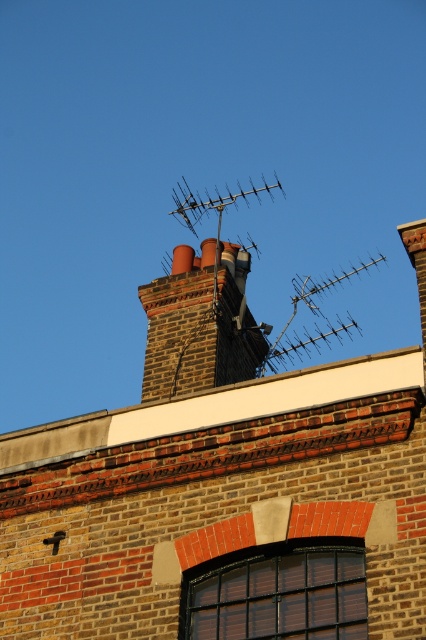
Question: Can you confirm if metallic antenna at upper center is positioned above metallic silver antenna at center?

Choices:
 (A) yes
 (B) no

Answer: (B)

Question: Is brick chimney at center further to the viewer compared to metallic silver antenna at center?

Choices:
 (A) no
 (B) yes

Answer: (A)

Question: Among these points, which one is nearest to the camera?

Choices:
 (A) pyautogui.click(x=213, y=198)
 (B) pyautogui.click(x=357, y=264)
 (C) pyautogui.click(x=210, y=300)

Answer: (C)

Question: Estimate the real-world distances between objects in this image. Which object is farther from the brick chimney at center?

Choices:
 (A) metallic antenna at upper center
 (B) metallic silver antenna at center

Answer: (A)

Question: Estimate the real-world distances between objects in this image. Which object is farther from the brick chimney at center?

Choices:
 (A) metallic silver antenna at center
 (B) metallic antenna at upper center

Answer: (B)

Question: Is metallic antenna at upper center closer to camera compared to metallic silver antenna at center?

Choices:
 (A) yes
 (B) no

Answer: (B)